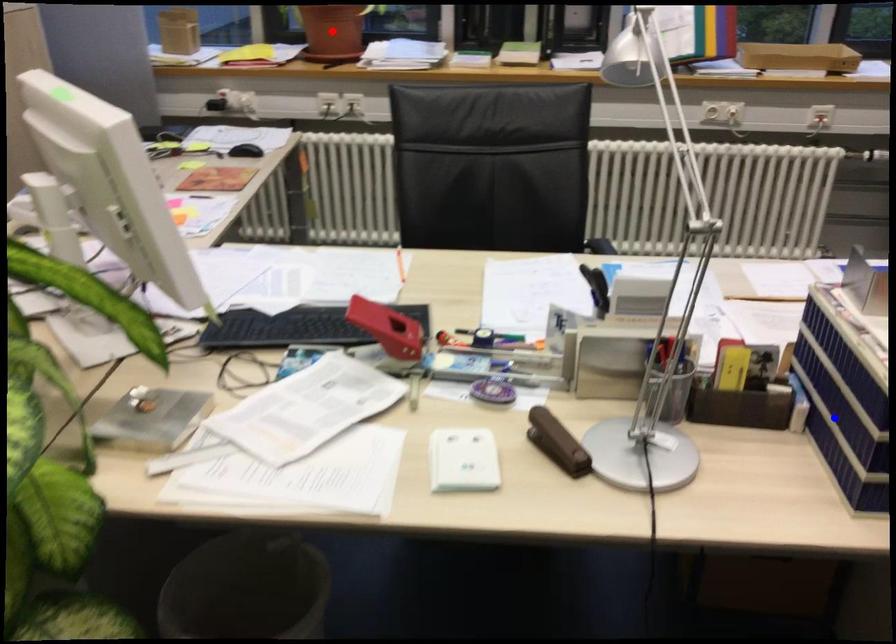
Question: Two points are marked on the image. Which point is closer to the camera?

Choices:
 (A) Blue point is closer.
 (B) Red point is closer.

Answer: (A)